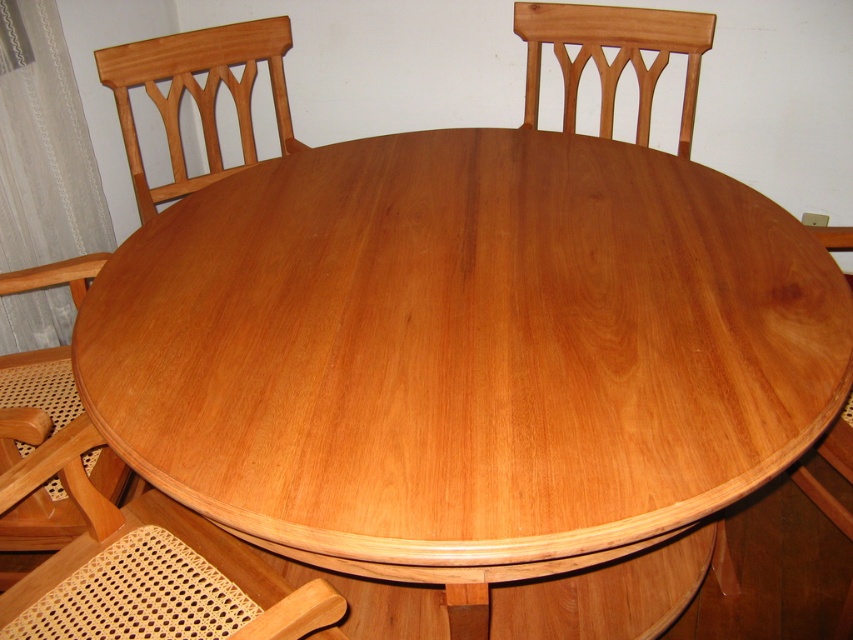
Between point (251, 396) and point (91, 509), which one is positioned behind?

Point (91, 509)

Does light brown wood table at center have a smaller size compared to light brown woven cane at lower left?

Actually, light brown wood table at center might be larger than light brown woven cane at lower left.

The height and width of the screenshot is (640, 853). In order to click on light brown wood table at center in this screenshot , I will do `click(480, 344)`.

Is light brown wood chair at lower left wider than light brown wood chair at upper center?

No.

What do you see at coordinates (33, 400) in the screenshot? I see `light brown wood chair at lower left` at bounding box center [33, 400].

In order to click on light brown wood chair at lower left in this screenshot , I will do `click(33, 400)`.

Is light brown woven cane at lower left shorter than light brown wood chair at upper left?

Yes, light brown woven cane at lower left is shorter than light brown wood chair at upper left.

Find the location of `light brown woven cane at lower left`. light brown woven cane at lower left is located at coordinates (148, 568).

At what (x,y) coordinates should I click in order to perform the action: click on light brown woven cane at lower left. Please return your answer as a coordinate pair (x, y). Image resolution: width=853 pixels, height=640 pixels. Looking at the image, I should click on (148, 568).